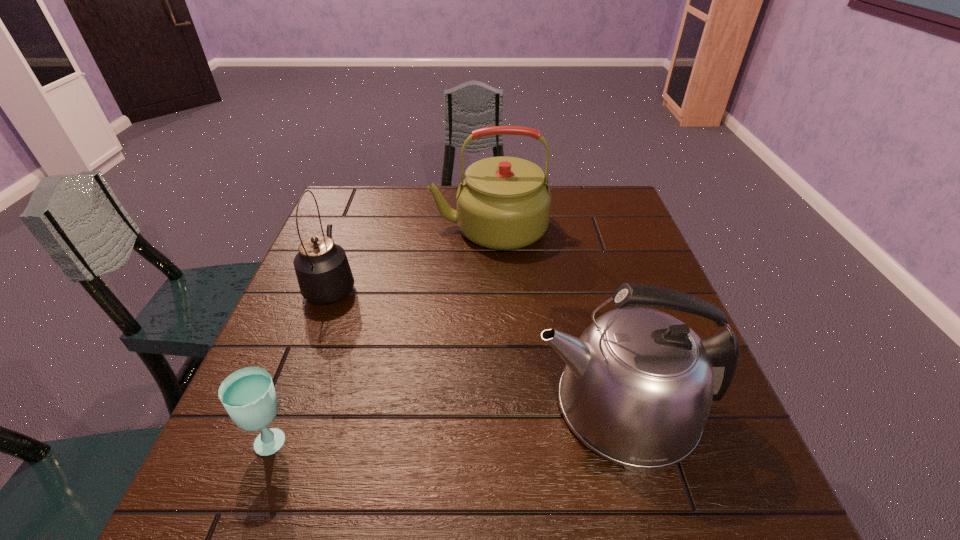
Locate which kettle is the closest to the nearest kettle. Please provide its 2D coordinates. Your answer should be formatted as a tuple, i.e. [(x, y)], where the tuple contains the x and y coordinates of a point satisfying the conditions above.

[(503, 203)]

In order to click on the closest kettle relative to the leftmost kettle in this screenshot , I will do `click(503, 203)`.

Where is `vacant space that satisfies the following two spatial constraints: 1. at the spout of the farthest object; 2. on the front side of the shortest object`? vacant space that satisfies the following two spatial constraints: 1. at the spout of the farthest object; 2. on the front side of the shortest object is located at coordinates (494, 440).

The height and width of the screenshot is (540, 960). What are the coordinates of `free spot that satisfies the following two spatial constraints: 1. at the spout of the farthest object; 2. on the front side of the shortest object` in the screenshot? It's located at pyautogui.click(x=494, y=440).